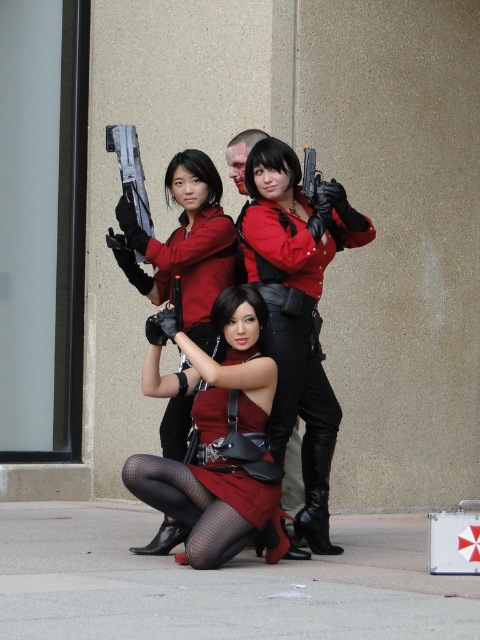
Question: Which point is farther from the camera taking this photo?

Choices:
 (A) (271, 243)
 (B) (201, 356)

Answer: (A)

Question: Can you confirm if matte black gun at center is positioned to the left of matte red dress at center?

Choices:
 (A) no
 (B) yes

Answer: (A)

Question: Is matte black gun at center to the left of matte red dress at center from the viewer's perspective?

Choices:
 (A) no
 (B) yes

Answer: (A)

Question: Does matte black gun at center appear on the right side of matte red dress at center?

Choices:
 (A) no
 (B) yes

Answer: (B)